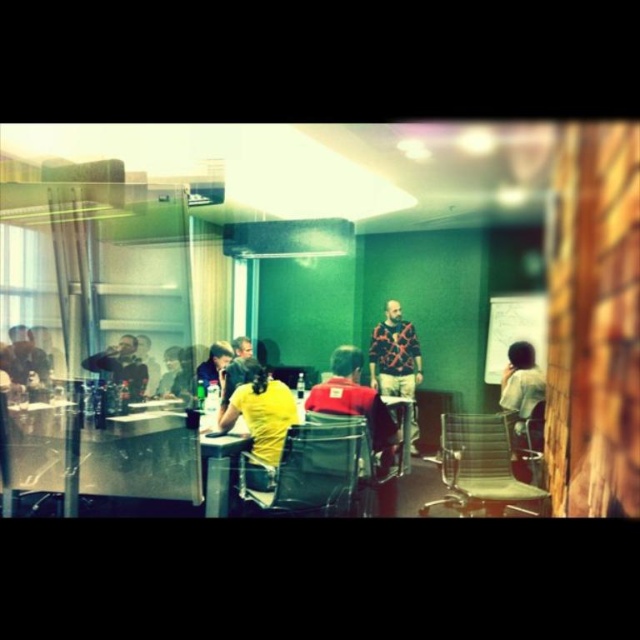
Question: Which object is farther from the camera taking this photo?

Choices:
 (A) plaid shirt at center
 (B) yellow matte shirt at center

Answer: (A)

Question: Based on their relative distances, which object is nearer to the leather-like chair at lower right?

Choices:
 (A) metallic mesh chair at lower left
 (B) metallic gray chair at lower right

Answer: (B)

Question: Can you confirm if yellow matte shirt at center is positioned below matte black chair at center?

Choices:
 (A) yes
 (B) no

Answer: (B)

Question: Is metallic gray chair at lower right thinner than matte black chair at center?

Choices:
 (A) no
 (B) yes

Answer: (B)

Question: Can you confirm if metallic gray chair at lower right is positioned below metallic mesh chair at lower left?

Choices:
 (A) no
 (B) yes

Answer: (B)

Question: Which point is farther from the camera taking this photo?

Choices:
 (A) (312, 506)
 (B) (378, 484)
 (C) (403, 349)
 (D) (244, 404)

Answer: (C)